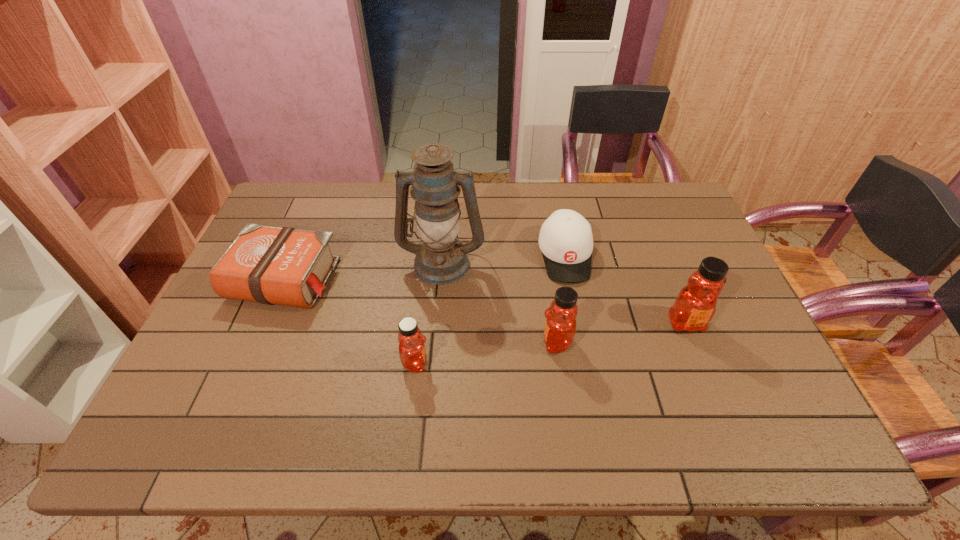
The image size is (960, 540). I want to click on vacant space at the near edge of the desktop, so click(652, 392).

Where is `free region at the left edge of the desktop`? This screenshot has width=960, height=540. free region at the left edge of the desktop is located at coordinates (241, 320).

Find the location of `vacant region at the far left corner of the desktop`. vacant region at the far left corner of the desktop is located at coordinates (285, 187).

Locate an element on the screen. The width and height of the screenshot is (960, 540). vacant space at the far right corner of the desktop is located at coordinates (675, 210).

Locate an element on the screen. The height and width of the screenshot is (540, 960). vacant space at the near right corner is located at coordinates (777, 397).

Where is `vacant area that lies between the baseball cap and the third shortest object`? The image size is (960, 540). vacant area that lies between the baseball cap and the third shortest object is located at coordinates (491, 309).

Where is `free area in between the leftmost honey and the baseball cap`? The height and width of the screenshot is (540, 960). free area in between the leftmost honey and the baseball cap is located at coordinates (491, 309).

You are a GUI agent. You are given a task and a screenshot of the screen. Output one action in this format:
    pyautogui.click(x=<x>, y=<y>)
    Task: Click on the free space between the Bible and the second honey from left to right
    
    Given the screenshot: What is the action you would take?
    pyautogui.click(x=420, y=310)

Identify the location of empty space that is in between the rightmost object and the leftmost object. Image resolution: width=960 pixels, height=540 pixels. (486, 301).

Find the location of a particular element. The height and width of the screenshot is (540, 960). free spot between the second tallest honey and the shortest honey is located at coordinates (486, 353).